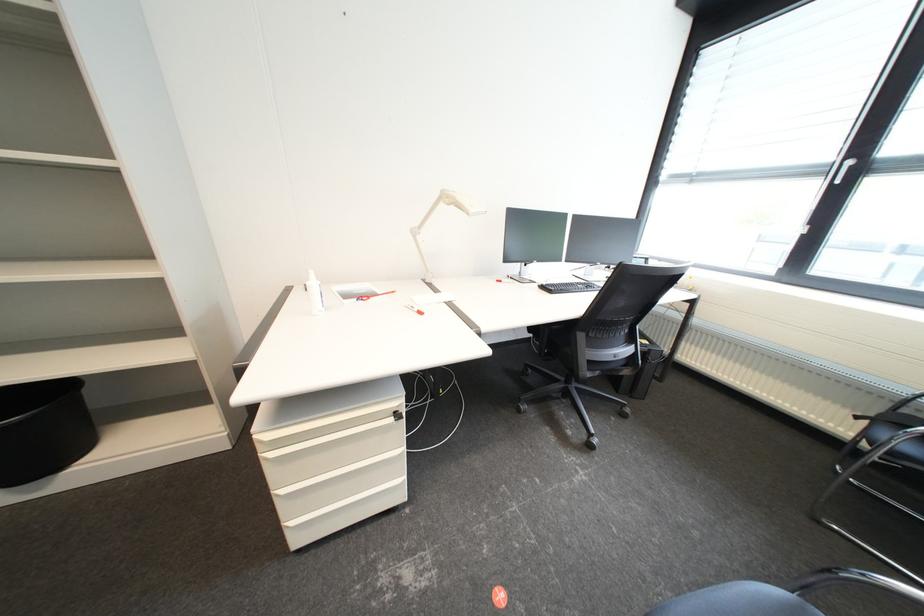
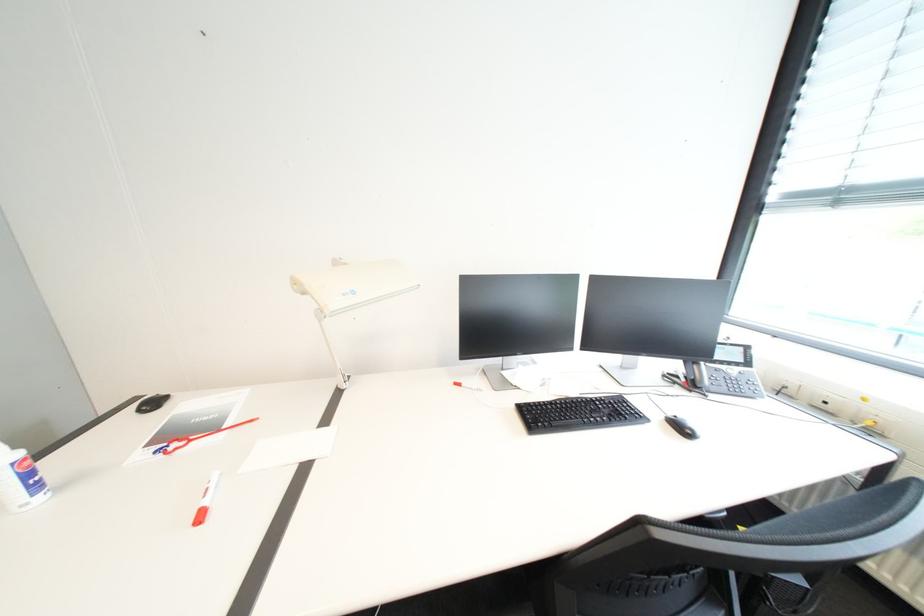
Question: The first image is from the beginning of the video and the second image is from the end. How did the camera likely rotate when shooting the video?

Choices:
 (A) Left
 (B) Right
 (C) Up
 (D) Down

Answer: (A)